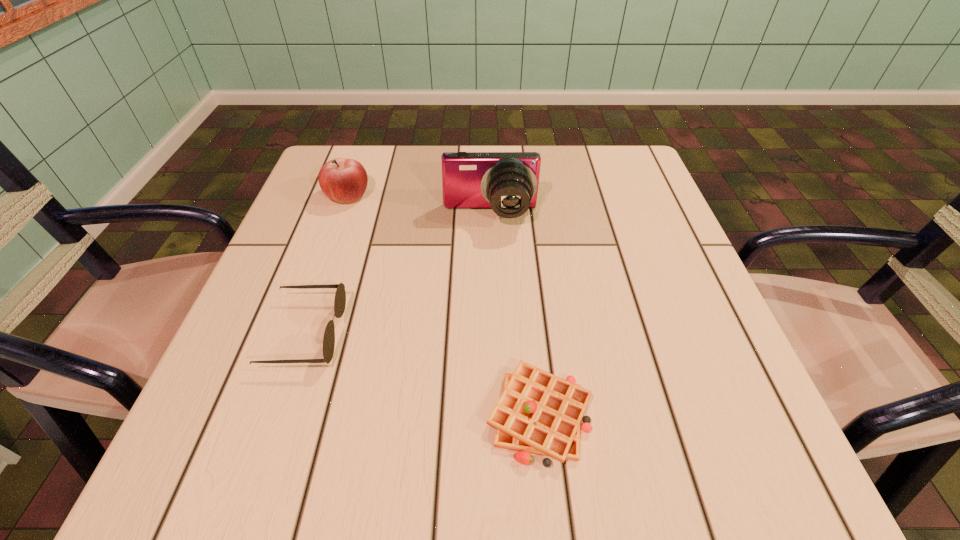
Locate an element on the screen. camera is located at coordinates (507, 182).

In order to click on the second tallest object in this screenshot , I will do `click(343, 180)`.

This screenshot has width=960, height=540. What are the coordinates of `sunglasses` in the screenshot? It's located at (340, 296).

The image size is (960, 540). What are the coordinates of `waffle` in the screenshot? It's located at (539, 413).

Locate an element on the screen. The height and width of the screenshot is (540, 960). free space located 0.150m on the front-facing side of the tallest object is located at coordinates (492, 281).

At what (x,y) coordinates should I click in order to perform the action: click on vacant space located on the front of the third shortest object. Please return your answer as a coordinate pair (x, y). The width and height of the screenshot is (960, 540). Looking at the image, I should click on (320, 272).

The width and height of the screenshot is (960, 540). What are the coordinates of `free space located on the front-facing side of the third tallest object` in the screenshot? It's located at (520, 333).

The width and height of the screenshot is (960, 540). I want to click on free space located on the left of the waffle, so click(445, 415).

Find the location of `object located at the far edge`. object located at the far edge is located at coordinates click(x=343, y=180).

The height and width of the screenshot is (540, 960). I want to click on object at the near edge, so click(x=539, y=413).